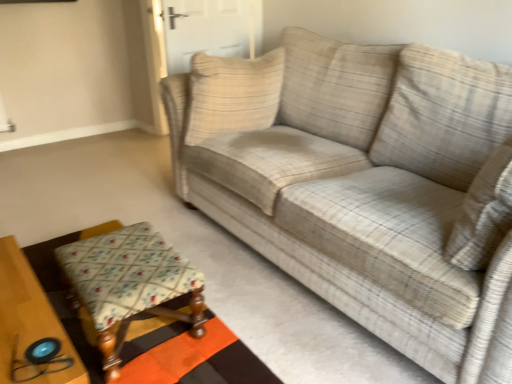
The height and width of the screenshot is (384, 512). What do you see at coordinates (195, 37) in the screenshot?
I see `white fabric door at center` at bounding box center [195, 37].

I want to click on beige textured pillow at center, so (233, 94).

Image resolution: width=512 pixels, height=384 pixels. What do you see at coordinates (29, 318) in the screenshot?
I see `wooden table at lower left` at bounding box center [29, 318].

The image size is (512, 384). Describe the element at coordinates (362, 184) in the screenshot. I see `plaid fabric couch at center` at that location.

You are a GUI agent. You are given a task and a screenshot of the screen. Output one action in this format:
    pyautogui.click(x=<x>, y=<y>)
    Task: Click on the white fabric door at center
    The height and width of the screenshot is (384, 512).
    Given the screenshot: What is the action you would take?
    pyautogui.click(x=195, y=37)

Looking at their sizes, would you say wooden table at lower left is wider or thinner than plaid fabric couch at center?

In the image, wooden table at lower left appears to be more narrow than plaid fabric couch at center.

Is wooden table at lower left placed right next to plaid fabric couch at center?

No, wooden table at lower left is not with plaid fabric couch at center.

From a real-world perspective, which is physically above, wooden table at lower left or plaid fabric couch at center?

In real-world perspective, plaid fabric couch at center is above.

From the image's perspective, is wooden table at lower left above or below plaid fabric couch at center?

From the image's perspective, wooden table at lower left appears below plaid fabric couch at center.

Are plaid fabric couch at center and wooden table at lower left far apart?

Yes.

In the scene shown: What's the angular difference between plaid fabric couch at center and wooden table at lower left's facing directions?

The angle between the facing direction of plaid fabric couch at center and the facing direction of wooden table at lower left is 177 degrees.

Is plaid fabric couch at center bigger or smaller than wooden table at lower left?

Clearly, plaid fabric couch at center is larger in size than wooden table at lower left.

From a real-world perspective, is beige textured pillow at center located beneath wooden table at lower left?

No, from a real-world perspective, beige textured pillow at center is not beneath wooden table at lower left.

Considering the points (234, 117) and (46, 297), which point is in front, point (234, 117) or point (46, 297)?

Positioned in front is point (46, 297).

Can you confirm if beige textured pillow at center is thinner than wooden table at lower left?

Incorrect, the width of beige textured pillow at center is not less than that of wooden table at lower left.

Is floral fabric stool at lower left oriented away from beige textured pillow at center?

No.

From the image's perspective, is floral fabric stool at lower left over beige textured pillow at center?

No, from the image's perspective, floral fabric stool at lower left is not on top of beige textured pillow at center.

From a real-world perspective, who is located higher, floral fabric stool at lower left or beige textured pillow at center?

beige textured pillow at center is physically above.

Which of these two, floral fabric stool at lower left or beige textured pillow at center, is bigger?

Bigger between the two is beige textured pillow at center.

Who is more distant, plaid fabric couch at center or white fabric door at center?

Positioned behind is white fabric door at center.

Which object is wider, plaid fabric couch at center or white fabric door at center?

Wider between the two is plaid fabric couch at center.

Is plaid fabric couch at center to the right of white fabric door at center from the viewer's perspective?

Correct, you'll find plaid fabric couch at center to the right of white fabric door at center.

In the scene shown: Which object is positioned more to the left, floral fabric stool at lower left or plaid fabric couch at center?

Positioned to the left is floral fabric stool at lower left.

Based on the photo, is floral fabric stool at lower left positioned with its back to plaid fabric couch at center?

Yes, floral fabric stool at lower left's orientation is away from plaid fabric couch at center.

Where is `studio couch on the right side of floral fabric stool at lower left`? studio couch on the right side of floral fabric stool at lower left is located at coordinates (362, 184).

Which object is closer to the camera, wooden table at lower left or white fabric door at center?

wooden table at lower left is in front.

Does wooden table at lower left have a greater width compared to white fabric door at center?

Correct, the width of wooden table at lower left exceeds that of white fabric door at center.

Is wooden table at lower left beside white fabric door at center?

They are not placed beside each other.

Is wooden table at lower left turned away from white fabric door at center?

No, wooden table at lower left is not facing away from white fabric door at center.

Locate an element on the screen. The height and width of the screenshot is (384, 512). studio couch in front of the wooden table at lower left is located at coordinates (362, 184).

Find the location of `studio couch above the wooden table at lower left (from the image's perspective)`. studio couch above the wooden table at lower left (from the image's perspective) is located at coordinates (362, 184).

Which object lies further to the anchor point wooden table at lower left, floral fabric stool at lower left or plaid fabric couch at center?

plaid fabric couch at center.

Looking at this image, from the image, which object appears to be nearer to white fabric door at center, plaid fabric couch at center or wooden table at lower left?

plaid fabric couch at center is closer to white fabric door at center.

From the image, which object appears to be farther from white fabric door at center, floral fabric stool at lower left or beige textured pillow at center?

Based on the image, floral fabric stool at lower left appears to be further to white fabric door at center.

When comparing their distances from plaid fabric couch at center, does floral fabric stool at lower left or beige textured pillow at center seem further?

floral fabric stool at lower left.

When comparing their distances from floral fabric stool at lower left, does wooden table at lower left or plaid fabric couch at center seem further?

Among the two, plaid fabric couch at center is located further to floral fabric stool at lower left.

Considering their positions, is wooden table at lower left positioned closer to floral fabric stool at lower left than beige textured pillow at center?

Among the two, wooden table at lower left is located nearer to floral fabric stool at lower left.

Estimate the real-world distances between objects in this image. Which object is further from floral fabric stool at lower left, plaid fabric couch at center or white fabric door at center?

The object further to floral fabric stool at lower left is white fabric door at center.

When comparing their distances from beige textured pillow at center, does white fabric door at center or plaid fabric couch at center seem further?

The object further to beige textured pillow at center is white fabric door at center.

Where is `table positioned between plaid fabric couch at center and beige textured pillow at center from near to far`? The width and height of the screenshot is (512, 384). table positioned between plaid fabric couch at center and beige textured pillow at center from near to far is located at coordinates (29, 318).

Find the location of a particular element. Image resolution: width=512 pixels, height=384 pixels. stool between beige textured pillow at center and wooden table at lower left from top to bottom is located at coordinates (126, 284).

Where is `stool between plaid fabric couch at center and beige textured pillow at center along the z-axis`? stool between plaid fabric couch at center and beige textured pillow at center along the z-axis is located at coordinates (126, 284).

Identify the location of pillow between wooden table at lower left and white fabric door at center in the front-back direction. The image size is (512, 384). (233, 94).